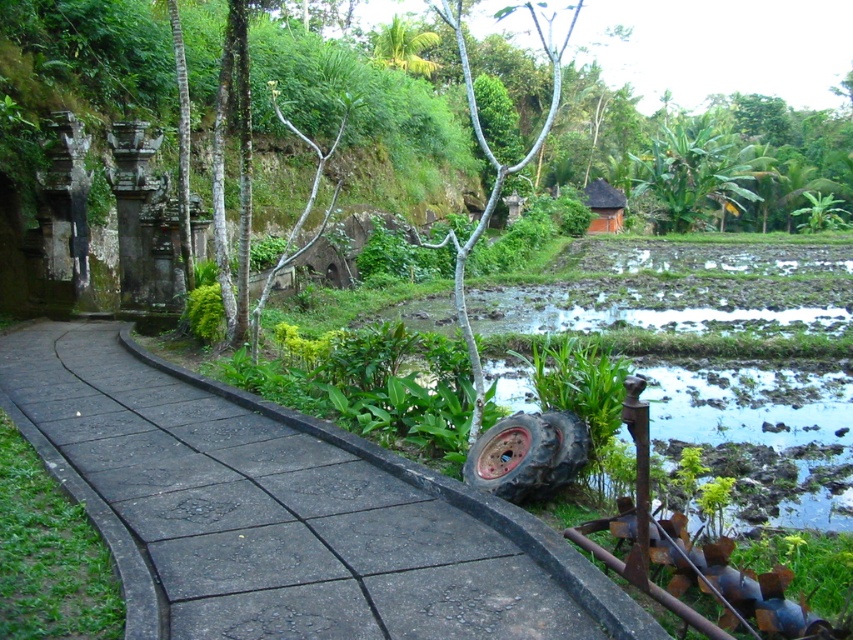
Does black concrete pavement at center appear over black rubber tire at lower right?

No, black concrete pavement at center is not above black rubber tire at lower right.

Which is in front, point (283, 611) or point (495, 456)?

Point (283, 611) is in front.

Which is in front, point (115, 355) or point (508, 476)?

Positioned in front is point (508, 476).

Where is `black concrete pavement at center`? Image resolution: width=853 pixels, height=640 pixels. black concrete pavement at center is located at coordinates (285, 513).

Between point (474, 458) and point (616, 230), which one is positioned in front?

Point (474, 458) is in front.

Can you confirm if black rubber tire at lower right is positioned to the right of brown clay hut at upper center?

Incorrect, black rubber tire at lower right is not on the right side of brown clay hut at upper center.

Who is more forward, (569, 412) or (607, 211)?

Point (569, 412) is in front.

The width and height of the screenshot is (853, 640). In order to click on black rubber tire at lower right in this screenshot , I will do `click(527, 456)`.

Can you confirm if black concrete pavement at center is positioned to the left of brown clay hut at upper center?

Correct, you'll find black concrete pavement at center to the left of brown clay hut at upper center.

Consider the image. Is black concrete pavement at center above brown clay hut at upper center?

No.

This screenshot has height=640, width=853. Find the location of `black concrete pavement at center`. black concrete pavement at center is located at coordinates (285, 513).